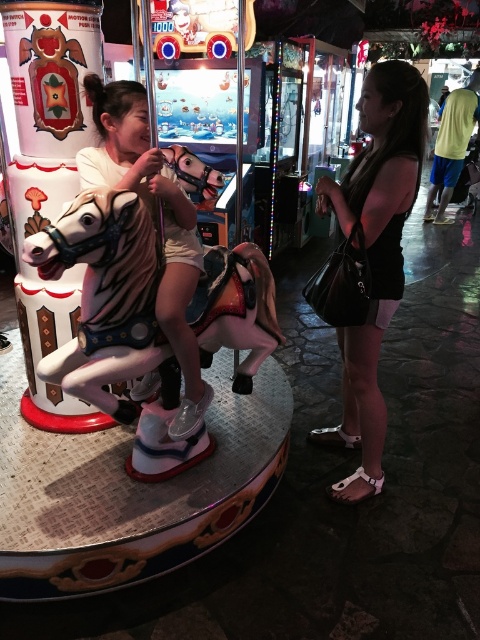
Can you confirm if shiny pink horse at center is positioned below black leather handbag at center?

Yes, shiny pink horse at center is below black leather handbag at center.

Which is in front, point (147, 282) or point (380, 296)?

Positioned in front is point (147, 282).

Is point (135, 284) less distant than point (424, 129)?

Yes, point (135, 284) is closer to viewer.

Identify the location of shiny pink horse at center. This screenshot has height=640, width=480. (104, 292).

Is black leather handbag at center closer to the viewer compared to matte white horse at center?

No, it is not.

Who is more forward, (315, 202) or (107, 134)?

Positioned in front is point (107, 134).

This screenshot has height=640, width=480. What do you see at coordinates (374, 253) in the screenshot? I see `black leather handbag at center` at bounding box center [374, 253].

Where is `black leather handbag at center`? Image resolution: width=480 pixels, height=640 pixels. black leather handbag at center is located at coordinates (374, 253).

Is shiny pink horse at center taller than matte white horse at center?

No, shiny pink horse at center is not taller than matte white horse at center.

Is shiny pink horse at center below matte white horse at center?

Correct, shiny pink horse at center is located below matte white horse at center.

In order to click on shiny pink horse at center in this screenshot , I will do `click(104, 292)`.

Locate an element on the screen. shiny pink horse at center is located at coordinates (104, 292).